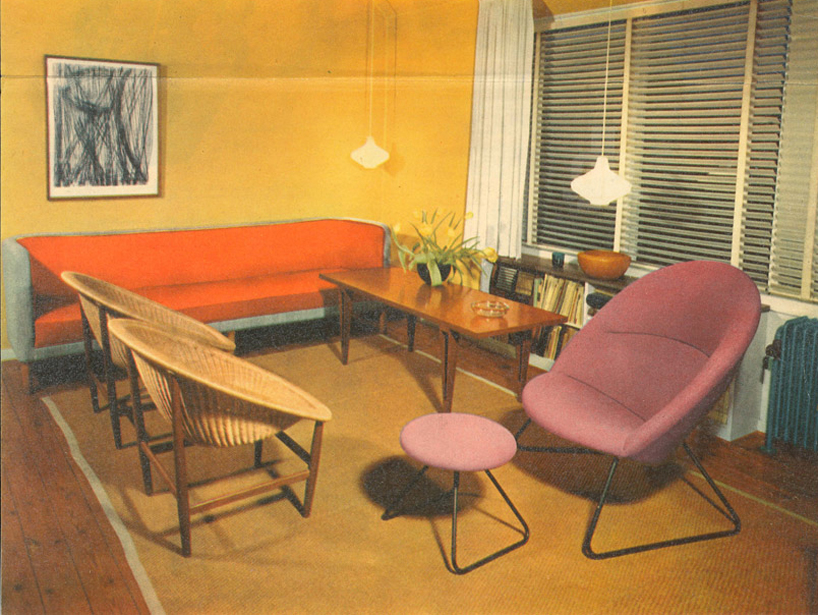
You are a GUI agent. You are given a task and a screenshot of the screen. Output one action in this format:
    pyautogui.click(x=<x>, y=<y>)
    Task: Click on the wooden coffee table
    The image size is (818, 615).
    Given the screenshot: What is the action you would take?
    pyautogui.click(x=451, y=317)